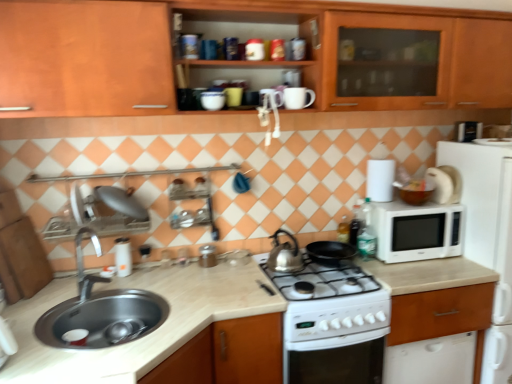
Find the location of `vacant space to the right of silver metallic faucet at sink left`. vacant space to the right of silver metallic faucet at sink left is located at coordinates (134, 294).